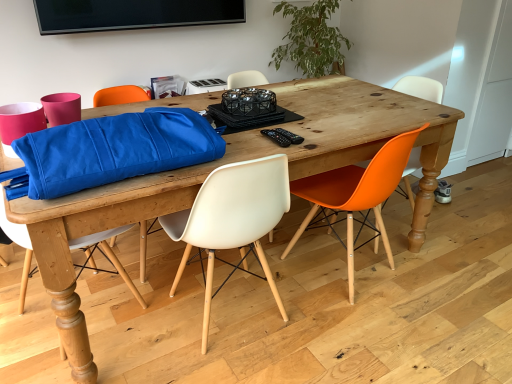
Find the location of a particular element. free point behind black plastic remote control at center, the 1th remote control in the left-to-right sequence is located at coordinates (278, 125).